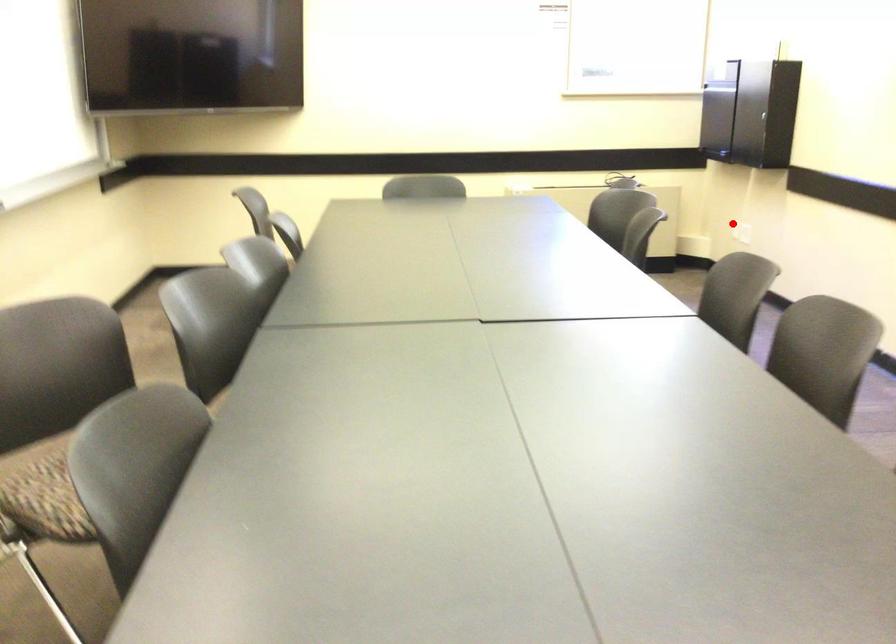
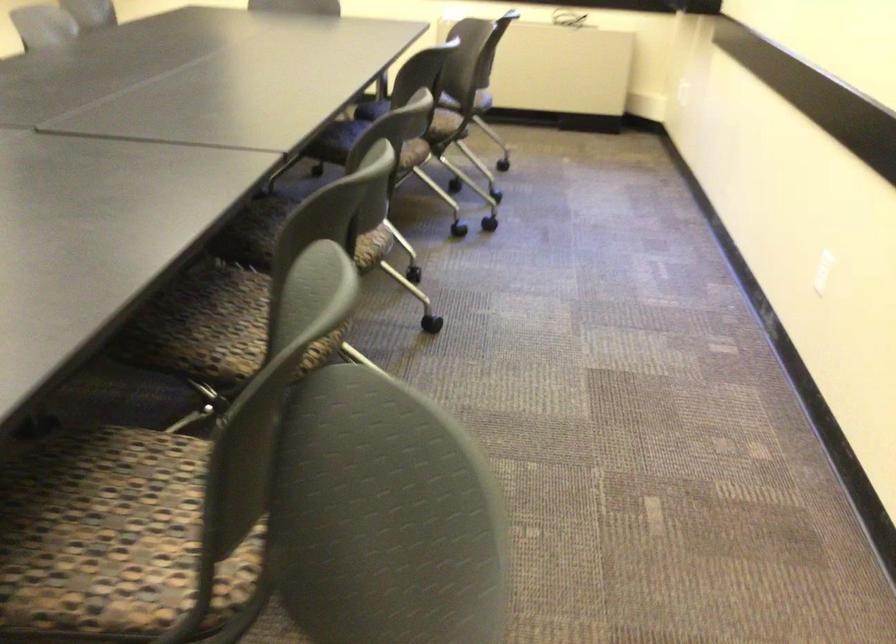
Question: A red point is marked in image1. In image2, is the corresponding 3D point closer to the camera or farther? Reply with the corresponding letter.

Choices:
 (A) The corresponding 3D point is closer.
 (B) The corresponding 3D point is farther.

Answer: (A)